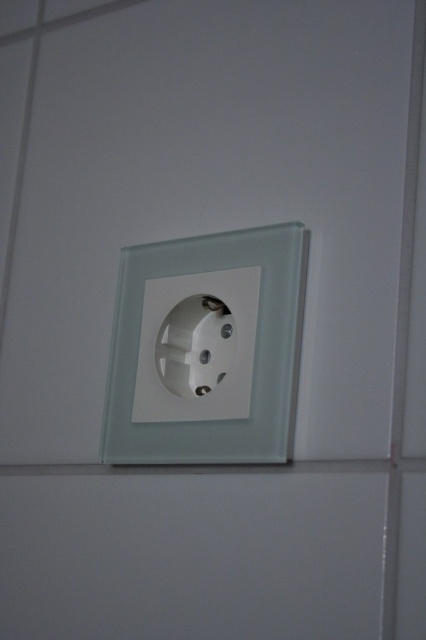
Question: Which of the following is the farthest from the observer?

Choices:
 (A) white plastic socket at center
 (B) transparent glass socket at center

Answer: (A)

Question: Does transparent glass socket at center have a smaller size compared to white plastic socket at center?

Choices:
 (A) yes
 (B) no

Answer: (B)

Question: Which of the following is the farthest from the observer?

Choices:
 (A) (264, 355)
 (B) (189, 301)

Answer: (B)

Question: Is transparent glass socket at center wider than white plastic socket at center?

Choices:
 (A) yes
 (B) no

Answer: (A)

Question: Observing the image, what is the correct spatial positioning of transparent glass socket at center in reference to white plastic socket at center?

Choices:
 (A) below
 (B) above

Answer: (B)